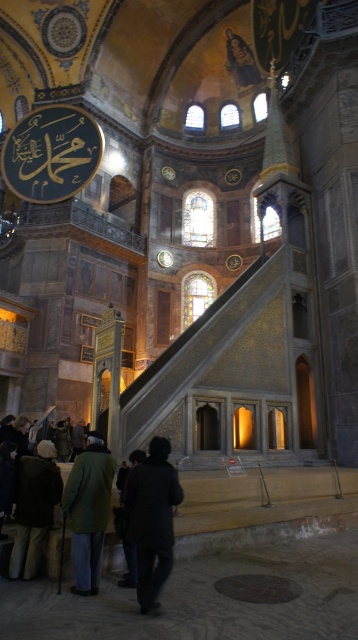
Looking at this image, you are standing in the grand historical building and see the dark gray coat at lower center and the dark green coat at lower left. Which coat is nearer to you?

The dark gray coat at lower center is closer to the viewer than the dark green coat at lower left.